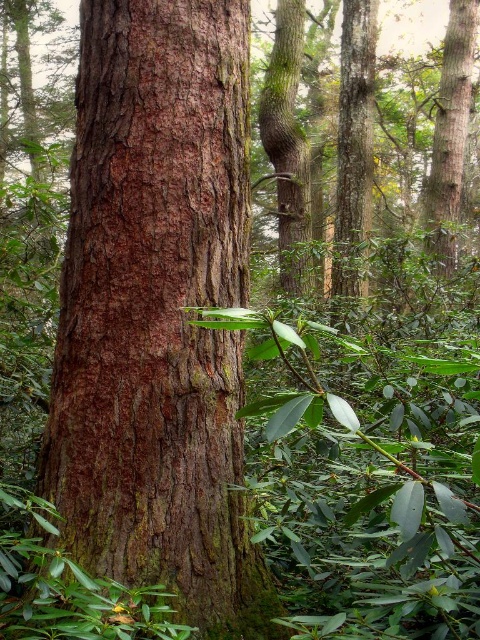
Question: Among these objects, which one is farthest from the camera?

Choices:
 (A) smooth brown tree trunk at upper right
 (B) brown rough bark tree trunk at left

Answer: (A)

Question: Is brown rough bark tree trunk at left wider than smooth brown tree trunk at upper right?

Choices:
 (A) yes
 (B) no

Answer: (B)

Question: Does brown rough bark tree trunk at left have a greater width compared to smooth brown tree trunk at upper right?

Choices:
 (A) yes
 (B) no

Answer: (B)

Question: Does brown rough bark tree trunk at left appear over smooth brown tree trunk at upper right?

Choices:
 (A) no
 (B) yes

Answer: (A)

Question: Which point is farther from the camera taking this photo?

Choices:
 (A) (455, 202)
 (B) (280, 612)

Answer: (A)